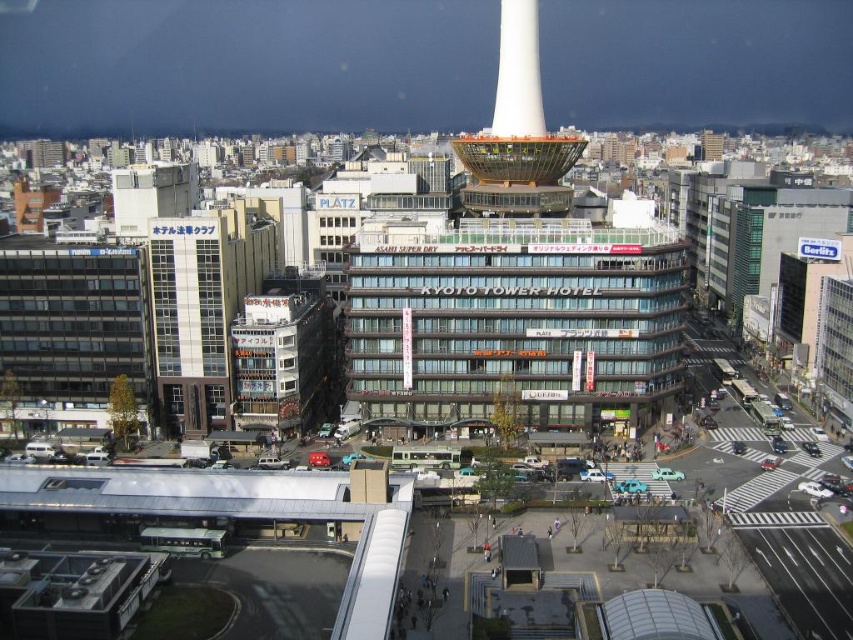
Locate an element on the screen. Image resolution: width=853 pixels, height=640 pixels. white glass building at left is located at coordinates (190, 320).

Is point (177, 400) positioned in front of point (550, 186)?

Yes, point (177, 400) is closer to viewer.

Between point (164, 356) and point (541, 134), which one is positioned behind?

The point (541, 134) is more distant.

I want to click on white glass building at left, so click(x=190, y=320).